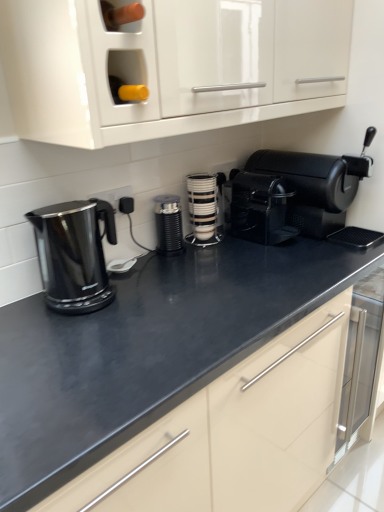
Question: From the image's perspective, would you say white glossy cup stack at center, arranged as the 2th kitchen appliance when viewed from the left, is positioned over black plastic electric outlet at center?

Choices:
 (A) yes
 (B) no

Answer: (A)

Question: Is white glossy cup stack at center, which appears as the first kitchen appliance when viewed from the right, positioned with its back to black plastic electric outlet at center?

Choices:
 (A) yes
 (B) no

Answer: (B)

Question: Considering the relative sizes of white glossy cup stack at center, which appears as the first kitchen appliance when viewed from the right, and black plastic electric outlet at center in the image provided, is white glossy cup stack at center, which appears as the first kitchen appliance when viewed from the right, thinner than black plastic electric outlet at center?

Choices:
 (A) no
 (B) yes

Answer: (A)

Question: Is white glossy cup stack at center, which appears as the first kitchen appliance when viewed from the right, next to black plastic electric outlet at center and touching it?

Choices:
 (A) yes
 (B) no

Answer: (B)

Question: Is white glossy cup stack at center, arranged as the 2th kitchen appliance when viewed from the left, to the right of black plastic electric outlet at center from the viewer's perspective?

Choices:
 (A) no
 (B) yes

Answer: (B)

Question: Is black matte coffee machine at right oriented towards white glossy cup stack at center, which appears as the first kitchen appliance when viewed from the right?

Choices:
 (A) yes
 (B) no

Answer: (B)

Question: From a real-world perspective, does black matte coffee machine at right sit lower than white glossy cup stack at center, which appears as the first kitchen appliance when viewed from the right?

Choices:
 (A) no
 (B) yes

Answer: (A)

Question: Is black matte coffee machine at right placed right next to white glossy cup stack at center, which appears as the first kitchen appliance when viewed from the right?

Choices:
 (A) yes
 (B) no

Answer: (B)

Question: Is black matte coffee machine at right positioned before white glossy cup stack at center, which appears as the first kitchen appliance when viewed from the right?

Choices:
 (A) yes
 (B) no

Answer: (A)

Question: From the image's perspective, is black matte coffee machine at right under white glossy cup stack at center, which appears as the first kitchen appliance when viewed from the right?

Choices:
 (A) no
 (B) yes

Answer: (A)

Question: Is black matte coffee machine at right at the left side of white glossy cup stack at center, which appears as the first kitchen appliance when viewed from the right?

Choices:
 (A) no
 (B) yes

Answer: (A)

Question: Can you see black matte coffee grinder at center, which is counted as the second kitchen appliance, starting from the right, touching black matte coffee machine at right?

Choices:
 (A) yes
 (B) no

Answer: (B)